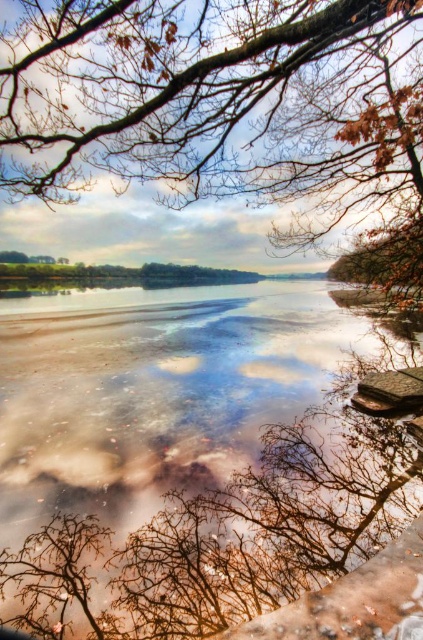
Question: Which point is closer to the camera?

Choices:
 (A) translucent glass river at center
 (B) brown textured branches at upper center

Answer: (A)

Question: Among these objects, which one is nearest to the camera?

Choices:
 (A) brown textured branches at upper center
 (B) translucent glass river at center

Answer: (B)

Question: Does translucent glass river at center come in front of brown textured branches at upper center?

Choices:
 (A) no
 (B) yes

Answer: (B)

Question: Can you confirm if translucent glass river at center is positioned above brown textured branches at upper center?

Choices:
 (A) no
 (B) yes

Answer: (A)

Question: Among these objects, which one is nearest to the camera?

Choices:
 (A) brown textured branches at upper center
 (B) translucent glass river at center

Answer: (B)

Question: Considering the relative positions of translucent glass river at center and brown textured branches at upper center in the image provided, where is translucent glass river at center located with respect to brown textured branches at upper center?

Choices:
 (A) below
 (B) above

Answer: (A)